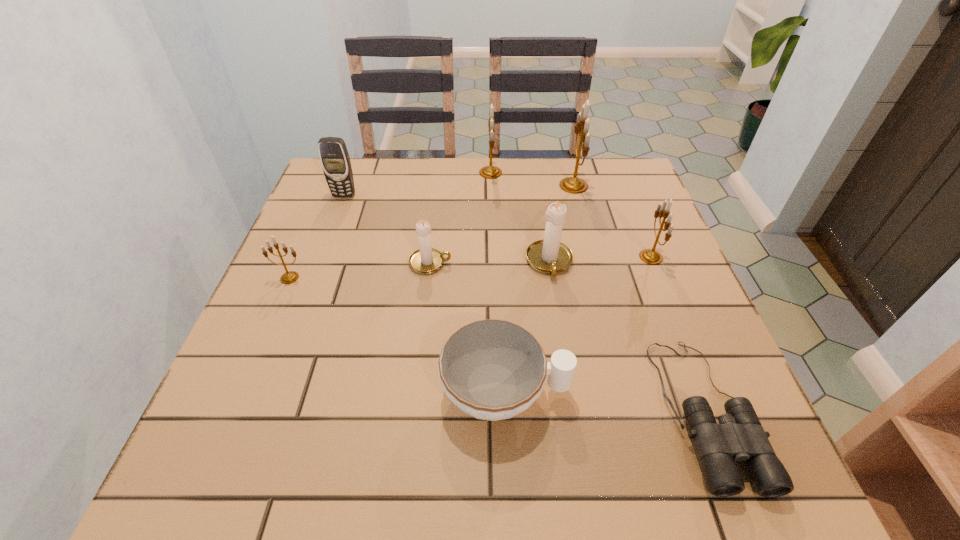
You are a GUI agent. You are given a task and a screenshot of the screen. Output one action in this format:
    pyautogui.click(x=<x>, y=<y>)
    Task: Click on the vacant region between the second gold candelabrum from right to left and the rightmost candle holder
    The width and height of the screenshot is (960, 540).
    Given the screenshot: What is the action you would take?
    pyautogui.click(x=612, y=221)

At what (x,y) coordinates should I click in order to perform the action: click on free space between the second candle holder from left to right and the third gold candelabrum from left to right. Please return your answer as a coordinate pair (x, y). Image resolution: width=960 pixels, height=540 pixels. Looking at the image, I should click on (502, 224).

You are a GUI agent. You are given a task and a screenshot of the screen. Output one action in this format:
    pyautogui.click(x=<x>, y=<y>)
    Task: Click on the unoccupied position between the leftmost gold candelabrum and the eighth tallest object
    The width and height of the screenshot is (960, 540).
    Given the screenshot: What is the action you would take?
    pyautogui.click(x=397, y=335)

Where is `free space between the cellular telephone and the fourth candle holder from right to left`? free space between the cellular telephone and the fourth candle holder from right to left is located at coordinates (418, 184).

This screenshot has height=540, width=960. I want to click on free space that is in between the seventh object from left to right and the binoculars, so click(639, 298).

Where is `vacant space in between the cellular telephone and the second gold candelabrum from right to left`? vacant space in between the cellular telephone and the second gold candelabrum from right to left is located at coordinates (459, 191).

Image resolution: width=960 pixels, height=540 pixels. Find the location of `unoccupied area between the second gold candelabrum from right to left and the nearest gold candelabrum`. unoccupied area between the second gold candelabrum from right to left and the nearest gold candelabrum is located at coordinates (432, 232).

In order to click on object that is the seventh closest to the third gold candelabrum from right to left in this screenshot , I will do point(491,369).

Locate which object ranks in proximity to the fourth candle holder from left to right. Please provide its 2D coordinates. Your answer should be formatted as a tuple, i.e. [(x, y)], where the tuple contains the x and y coordinates of a point satisfying the conditions above.

[(651, 256)]

Identify the location of candle holder that is the second closest one to the binoculars. Image resolution: width=960 pixels, height=540 pixels. (651, 256).